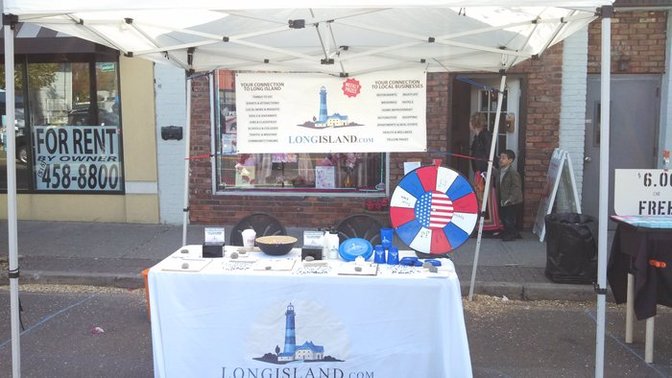
Locate an element on the screen. wooden table is located at coordinates (144, 274).